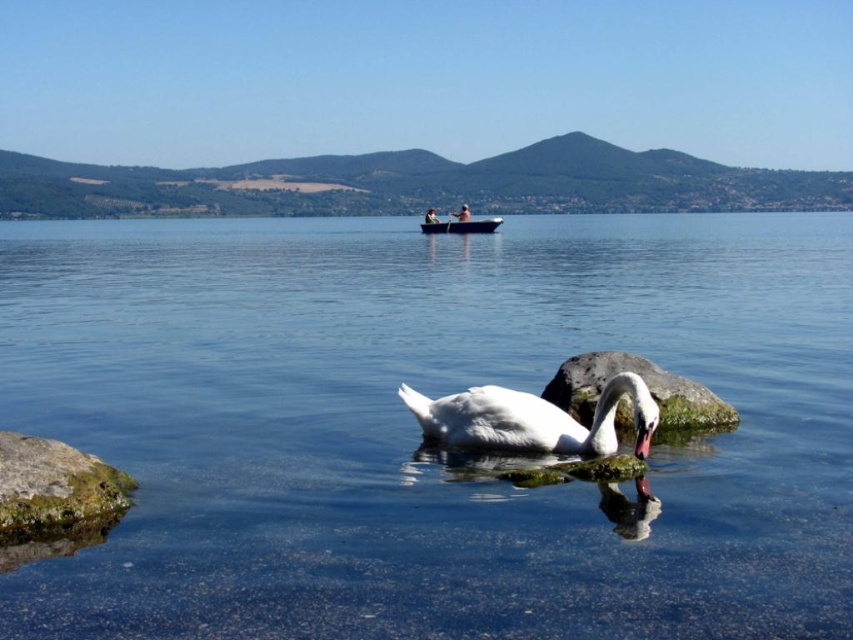
Question: Which is farther from the gray smooth rock at center?

Choices:
 (A) white glossy swan at center
 (B) clear water at center
 (C) green mossy rock at lower left
 (D) blue glossy boat at center

Answer: (D)

Question: Does white glossy swan at center have a lesser width compared to blue glossy boat at center?

Choices:
 (A) no
 (B) yes

Answer: (B)

Question: Which point appears farthest from the camera in this image?

Choices:
 (A) (720, 412)
 (B) (460, 221)

Answer: (B)

Question: Does clear water at center appear on the right side of green mossy rock at lower left?

Choices:
 (A) no
 (B) yes

Answer: (B)

Question: Considering the relative positions of clear water at center and gray smooth rock at center in the image provided, where is clear water at center located with respect to gray smooth rock at center?

Choices:
 (A) above
 (B) below

Answer: (A)

Question: Which of these objects is positioned closest to the white glossy swan at center?

Choices:
 (A) clear water at center
 (B) gray smooth rock at center
 (C) green mossy rock at lower left

Answer: (B)